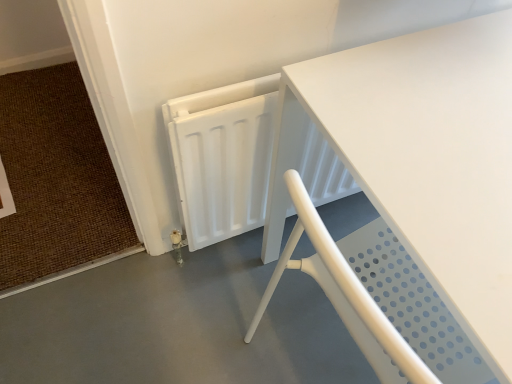
Question: From the image's perspective, is white matte table at center located beneath white perforated chair at lower right?

Choices:
 (A) yes
 (B) no

Answer: (B)

Question: Does white matte table at center lie in front of white perforated chair at lower right?

Choices:
 (A) no
 (B) yes

Answer: (B)

Question: Can you confirm if white matte table at center is wider than white perforated chair at lower right?

Choices:
 (A) yes
 (B) no

Answer: (B)

Question: From a real-world perspective, does white matte table at center sit lower than white perforated chair at lower right?

Choices:
 (A) no
 (B) yes

Answer: (A)

Question: Is white matte table at center behind white perforated chair at lower right?

Choices:
 (A) no
 (B) yes

Answer: (A)

Question: Based on their positions, is brown woven mat at lower left located to the left or right of white perforated chair at lower right?

Choices:
 (A) left
 (B) right

Answer: (A)

Question: In terms of width, does brown woven mat at lower left look wider or thinner when compared to white perforated chair at lower right?

Choices:
 (A) wide
 (B) thin

Answer: (A)

Question: Considering their positions, is brown woven mat at lower left located in front of or behind white perforated chair at lower right?

Choices:
 (A) behind
 (B) front

Answer: (A)

Question: Is brown woven mat at lower left spatially inside white perforated chair at lower right, or outside of it?

Choices:
 (A) inside
 (B) outside

Answer: (B)

Question: Relative to white matte table at center, is brown woven mat at lower left in front or behind?

Choices:
 (A) front
 (B) behind

Answer: (B)

Question: From a real-world perspective, is brown woven mat at lower left above or below white matte table at center?

Choices:
 (A) above
 (B) below

Answer: (B)

Question: In the image, is brown woven mat at lower left on the left side or the right side of white matte table at center?

Choices:
 (A) left
 (B) right

Answer: (A)

Question: From the image's perspective, is brown woven mat at lower left above or below white matte table at center?

Choices:
 (A) below
 (B) above

Answer: (B)

Question: Is white perforated chair at lower right taller or shorter than brown woven mat at lower left?

Choices:
 (A) tall
 (B) short

Answer: (B)

Question: From a real-world perspective, relative to brown woven mat at lower left, is white perforated chair at lower right vertically above or below?

Choices:
 (A) below
 (B) above

Answer: (A)